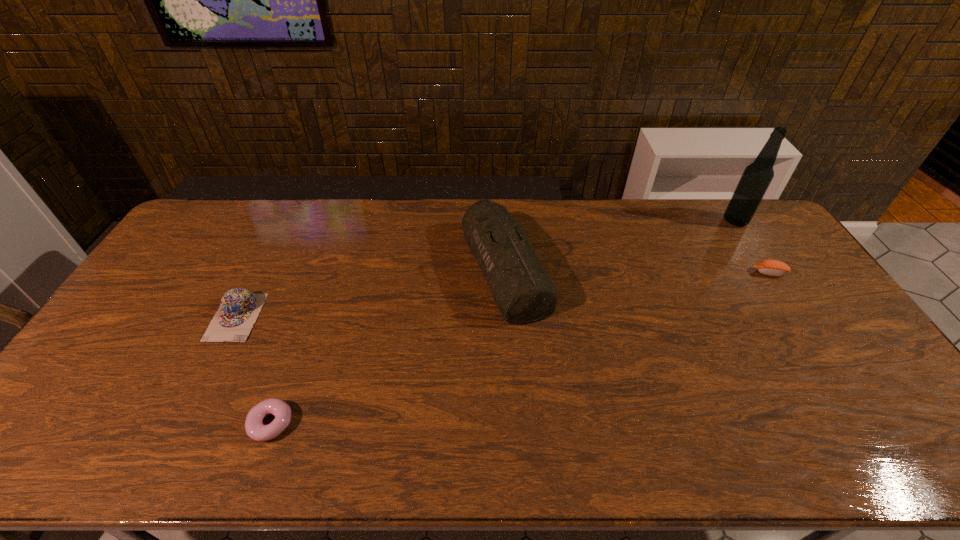
Find the location of `vacant space located on the front, side, and top of the cap`. vacant space located on the front, side, and top of the cap is located at coordinates (174, 440).

Find the location of a particular element. free space located on the back of the second shortest object is located at coordinates (720, 198).

You are a GUI agent. You are given a task and a screenshot of the screen. Output one action in this format:
    pyautogui.click(x=<x>, y=<y>)
    Task: Click on the vacant space situated on the right of the shortest object
    The height and width of the screenshot is (540, 960).
    Given the screenshot: What is the action you would take?
    pyautogui.click(x=393, y=423)

The width and height of the screenshot is (960, 540). What are the coordinates of `alcohol positioned at the far edge` in the screenshot? It's located at (756, 178).

Image resolution: width=960 pixels, height=540 pixels. Find the location of `duffel bag located at the far edge`. duffel bag located at the far edge is located at coordinates (523, 291).

Where is `object located at the near edge`? object located at the near edge is located at coordinates (255, 429).

The height and width of the screenshot is (540, 960). In order to click on alcohol located in the right edge section of the desktop in this screenshot , I will do `click(756, 178)`.

Where is `sushi present at the right edge`? This screenshot has height=540, width=960. sushi present at the right edge is located at coordinates [x=770, y=267].

Where is `object that is at the far right corner`? The height and width of the screenshot is (540, 960). object that is at the far right corner is located at coordinates (756, 178).

Identify the location of free space at the far edge of the desktop. The height and width of the screenshot is (540, 960). (521, 213).